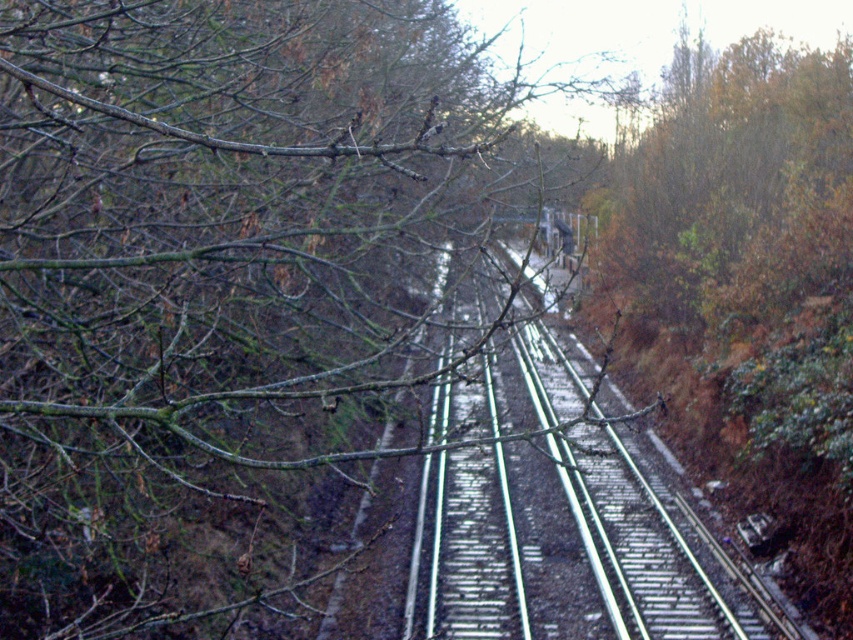
Question: Which point appears closest to the camera in this image?

Choices:
 (A) (251, 179)
 (B) (598, 435)

Answer: (A)

Question: Does green matte branches at upper left appear on the right side of metallic silver track at center?

Choices:
 (A) yes
 (B) no

Answer: (B)

Question: Is green matte branches at upper left below metallic silver track at center?

Choices:
 (A) no
 (B) yes

Answer: (A)

Question: In this image, where is green matte branches at upper left located relative to metallic silver track at center?

Choices:
 (A) below
 (B) above

Answer: (B)

Question: Which point appears closest to the camera in this image?

Choices:
 (A) (102, 340)
 (B) (636, 496)

Answer: (A)